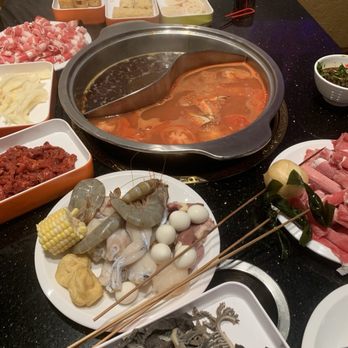
Locate an element on the screen. plate is located at coordinates (60, 299), (296, 152), (57, 65).